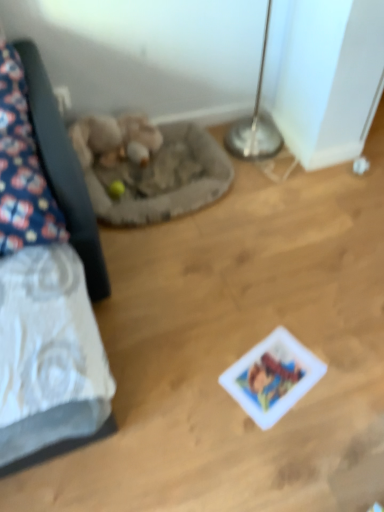
The image size is (384, 512). Find the location of `blank space to the left of white glossy card at center`. blank space to the left of white glossy card at center is located at coordinates (208, 374).